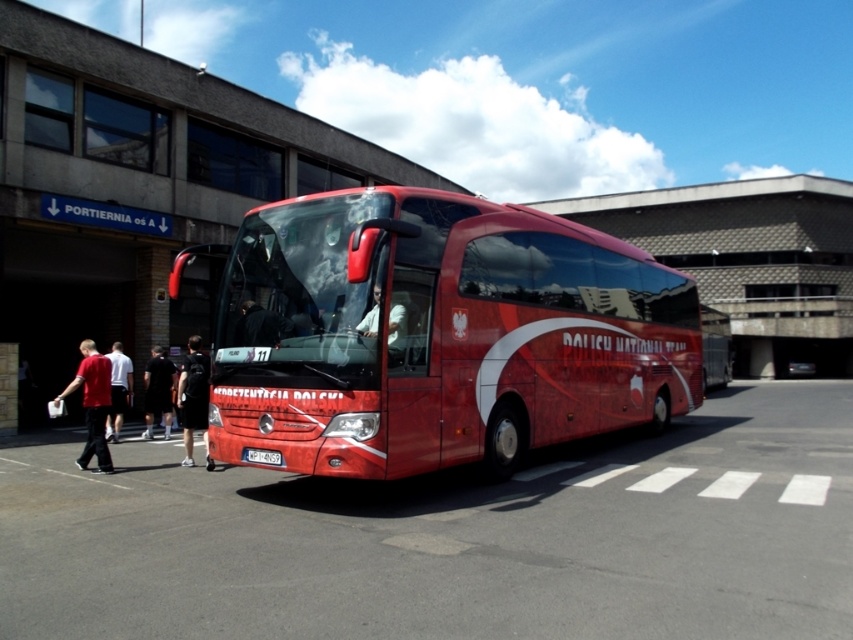
Does white cotton shirt at center have a lesser height compared to white fabric shirt at center?

No, white cotton shirt at center is not shorter than white fabric shirt at center.

Does white cotton shirt at center have a greater height compared to white fabric shirt at center?

Indeed, white cotton shirt at center has a greater height compared to white fabric shirt at center.

Measure the distance between white cotton shirt at center and camera.

white cotton shirt at center and camera are 11.71 meters apart from each other.

Locate an element on the screen. white cotton shirt at center is located at coordinates (119, 390).

Who is taller, glossy red bus at center or shiny red bus at center?

With more height is shiny red bus at center.

Consider the image. Does glossy red bus at center lie in front of shiny red bus at center?

Yes, it is.

Find the location of a particular element. The width and height of the screenshot is (853, 640). glossy red bus at center is located at coordinates (453, 538).

Where is `glossy red bus at center`? Image resolution: width=853 pixels, height=640 pixels. glossy red bus at center is located at coordinates (453, 538).

Can you confirm if shiny red bus at center is wider than black fabric pants at lower left?

Indeed, shiny red bus at center has a greater width compared to black fabric pants at lower left.

Who is positioned more to the right, shiny red bus at center or black fabric pants at lower left?

shiny red bus at center is more to the right.

Does point (271, 372) come farther from viewer compared to point (148, 381)?

No, (271, 372) is closer to viewer.

This screenshot has width=853, height=640. Find the location of `shiny red bus at center`. shiny red bus at center is located at coordinates (440, 336).